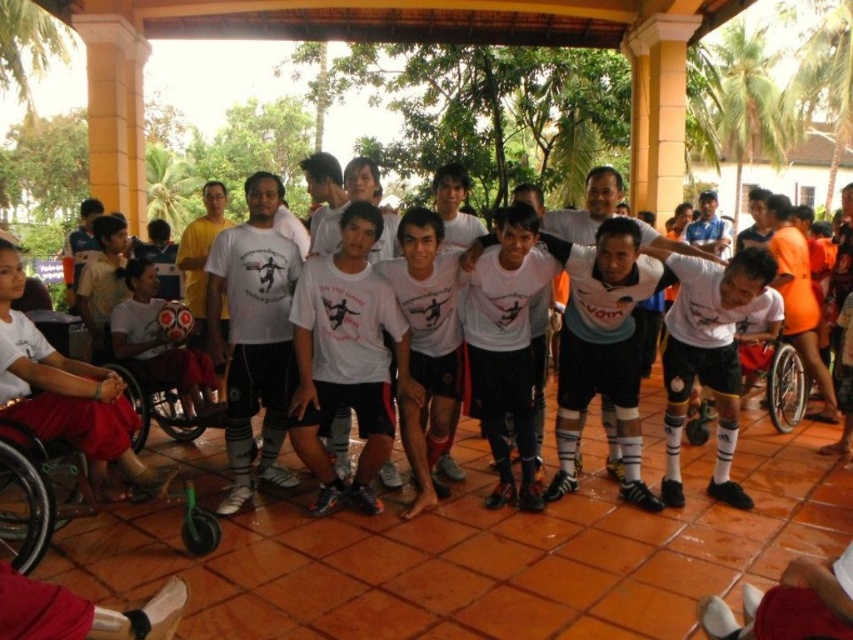
You are a photographer setting up for a group photo. You need to position two silver metallic wheelchairs so that they are the same size in the photo. Given the current setup where the silver metallic wheelchair at center is smaller than the silver metallic wheelchair at left, what adjustment should you make to achieve this?

To make the silver metallic wheelchair at center and the silver metallic wheelchair at left appear the same size in the photo, move the silver metallic wheelchair at center closer to the camera and move the silver metallic wheelchair at left farther away. This adjustment will balance their apparent sizes since objects closer to the camera appear larger.

You are organizing a team photo and need to ensure everyone fits in the frame. The matte white shirt at left and the black plastic wheelchair at lower left are part of the composition. Which object takes up more space in the photo?

The matte white shirt at left takes up more space in the photo because it is bigger than the black plastic wheelchair at lower left.

You are a photographer setting up for a group photo. You need to ensure that the white matte jersey at center and the silver metallic wheelchair at left are both clearly visible in the frame. Considering their heights, which object might require you to adjust the camera angle to capture both effectively?

The white matte jersey at center is taller than the silver metallic wheelchair at left. To capture both effectively, you might need to adjust the camera angle to account for the height difference, ensuring both are visible.